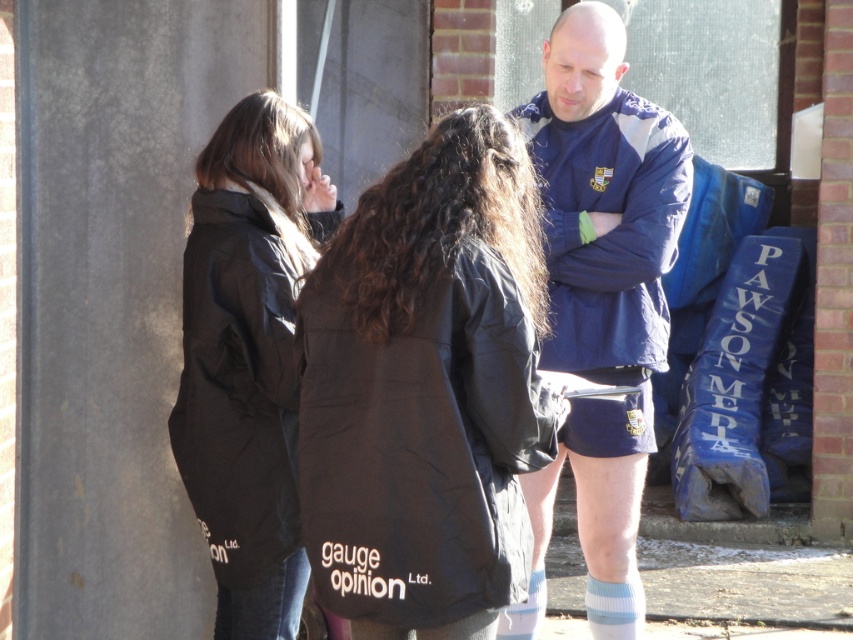
Question: Is black puffy jacket at center wider than blue jersey at center?

Choices:
 (A) yes
 (B) no

Answer: (A)

Question: Which object is positioned farthest from the light blue knit sock at lower center?

Choices:
 (A) blue jersey at center
 (B) black puffy jacket at center

Answer: (B)

Question: Among these points, which one is nearest to the camera?

Choices:
 (A) (640, 628)
 (B) (535, 577)
 (C) (438, 513)

Answer: (C)

Question: Can you confirm if blue jersey at center is thinner than light blue knit sock at lower center?

Choices:
 (A) no
 (B) yes

Answer: (A)

Question: Among these objects, which one is nearest to the camera?

Choices:
 (A) light blue knit sock at lower center
 (B) matte black jacket at left

Answer: (B)

Question: Does blue jersey at center have a lesser width compared to white knit sock at lower center?

Choices:
 (A) yes
 (B) no

Answer: (B)